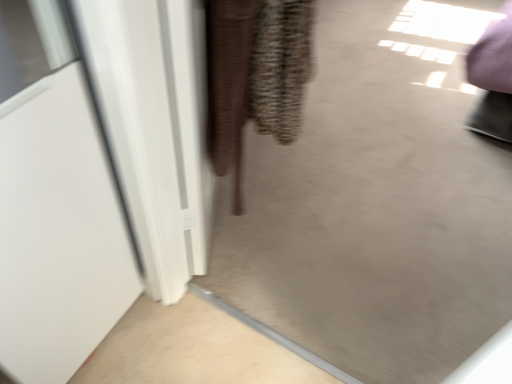
What do you see at coordinates (255, 76) in the screenshot?
I see `brown woven sweater at center` at bounding box center [255, 76].

Find the location of `brown woven sweater at center`. brown woven sweater at center is located at coordinates (255, 76).

Measure the distance between point (255, 103) and camera.

The distance of point (255, 103) from camera is 1.06 meters.

At what (x,y) coordinates should I click in order to perform the action: click on brown woven sweater at center. Please return your answer as a coordinate pair (x, y). Looking at the image, I should click on coord(255,76).